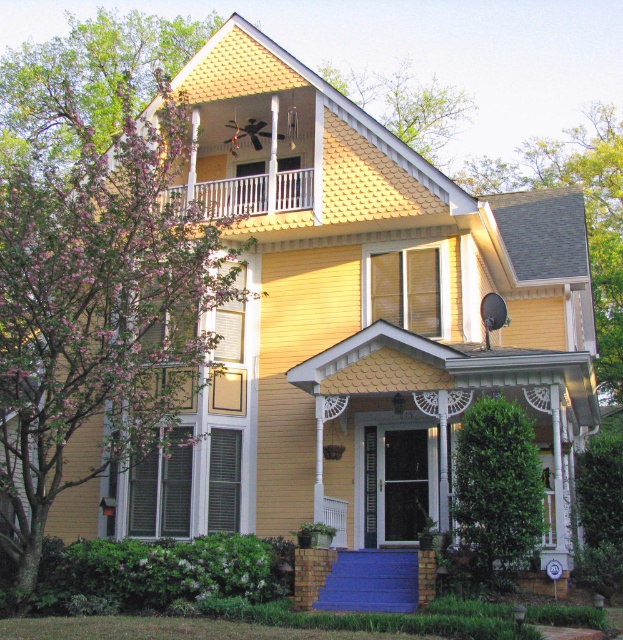
Question: Which of the following is the closest to the observer?

Choices:
 (A) (146, 275)
 (B) (178, 513)
 (C) (174, 188)
 (D) (399, 256)

Answer: (A)

Question: Which of the following is the farthest from the observer?

Choices:
 (A) (536, 528)
 (B) (237, 516)
 (C) (145, 513)

Answer: (C)

Question: Does green leafy bush at lower right lie behind white painted wood shutter at center?

Choices:
 (A) no
 (B) yes

Answer: (A)

Question: Which of the following is the farthest from the observer?

Choices:
 (A) white painted wood shutter at center
 (B) white metal railing at upper center

Answer: (B)

Question: Can you confirm if green leafy tree at upper right is positioned to the left of green leafy bush at lower right?

Choices:
 (A) yes
 (B) no

Answer: (B)

Question: Is green matte shutter at left positioned in front of white painted wood shutter at center?

Choices:
 (A) yes
 (B) no

Answer: (A)